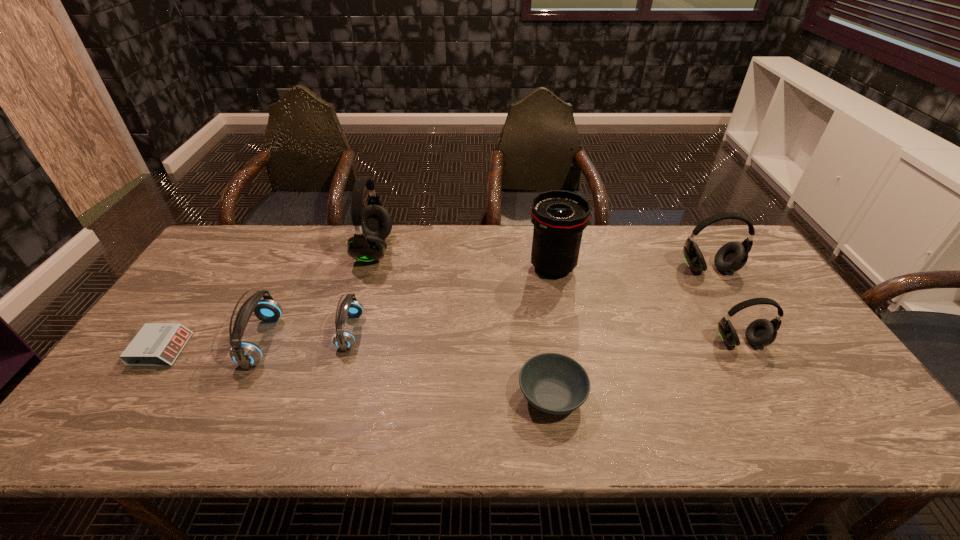
Select which headset appears as the second closest to the second tallest headset. Please provide its 2D coordinates. Your answer should be formatted as a tuple, i.e. [(x, y)], where the tuple contains the x and y coordinates of a point satisfying the conditions above.

[(373, 223)]

The width and height of the screenshot is (960, 540). I want to click on headset that stands as the fourth closest to the shortest object, so click(x=761, y=332).

Choose which black headset is the second nearest neighbor to the leftmost black headset. Please provide its 2D coordinates. Your answer should be formatted as a tuple, i.e. [(x, y)], where the tuple contains the x and y coordinates of a point satisfying the conditions above.

[(761, 332)]

The width and height of the screenshot is (960, 540). I want to click on black headset that is the closest to the tallest headset, so click(x=731, y=257).

At what (x,y) coordinates should I click in order to perform the action: click on vacant space that satisfies the following two spatial constraints: 1. on the front side of the telephoto lens; 2. on the ear cups of the smaller blue headset. Please return your answer as a coordinate pair (x, y). This screenshot has height=540, width=960. Looking at the image, I should click on (565, 332).

Image resolution: width=960 pixels, height=540 pixels. What are the coordinates of `vacant area in the image that satisfies the following two spatial constraints: 1. on the ear cups of the telephoto lens; 2. on the left side of the biggest black headset` in the screenshot? It's located at (369, 267).

You are a GUI agent. You are given a task and a screenshot of the screen. Output one action in this format:
    pyautogui.click(x=<x>, y=<y>)
    Task: Click on the free spot that satisfies the following two spatial constraints: 1. on the ear cups of the tallest headset; 2. on the back side of the telephoto lens
    Image resolution: width=960 pixels, height=540 pixels.
    Given the screenshot: What is the action you would take?
    pyautogui.click(x=369, y=267)

You are a GUI agent. You are given a task and a screenshot of the screen. Output one action in this format:
    pyautogui.click(x=<x>, y=<y>)
    Task: Click on the free space that satisfies the following two spatial constraints: 1. on the ear cups of the soup bowl; 2. on the right side of the shortest headset
    
    Given the screenshot: What is the action you would take?
    pyautogui.click(x=332, y=396)

Where is `vacant area that satisfies the following two spatial constraints: 1. on the ear cups of the gray soup bowl; 2. on the left side of the bigger blue headset`? vacant area that satisfies the following two spatial constraints: 1. on the ear cups of the gray soup bowl; 2. on the left side of the bigger blue headset is located at coordinates (236, 396).